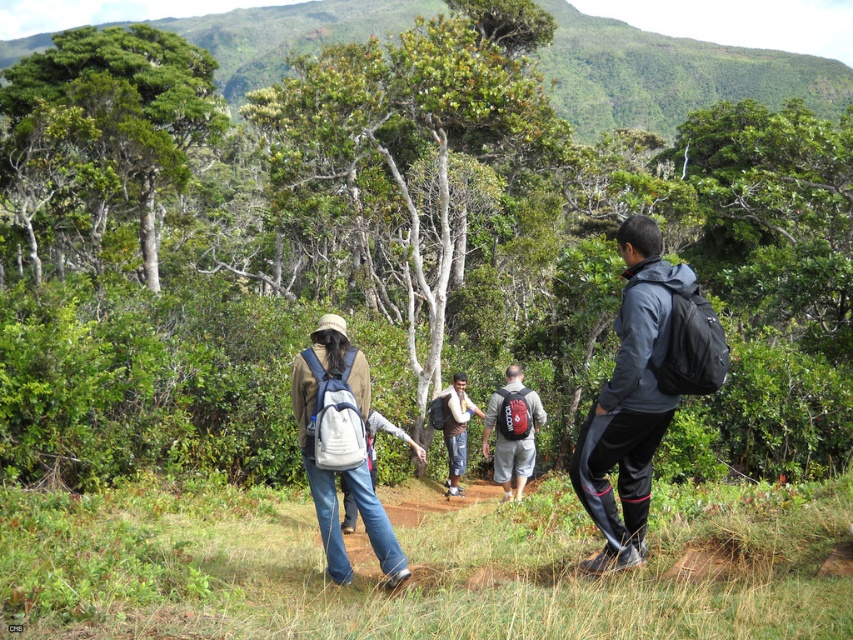
Can you confirm if matte white backpack at center-left is smaller than reddish-brown backpack at center?

Yes, matte white backpack at center-left is smaller than reddish-brown backpack at center.

At what (x,y) coordinates should I click in order to perform the action: click on matte white backpack at center-left. Please return your answer as a coordinate pair (x, y). Image resolution: width=853 pixels, height=640 pixels. Looking at the image, I should click on (318, 420).

Locate an element on the screen. This screenshot has width=853, height=640. matte white backpack at center-left is located at coordinates (318, 420).

Which is behind, point (434, 128) or point (466, 378)?

Positioned behind is point (434, 128).

Find the location of a particular element. The width and height of the screenshot is (853, 640). green leafy tree at center is located at coordinates (407, 157).

Is green matte tree at upper left behind matte gray jacket at center?

Yes.

Is green matte tree at upper left above matte gray jacket at center?

Yes.

Who is more forward, (129, 202) or (608, 568)?

Point (608, 568) is more forward.

Image resolution: width=853 pixels, height=640 pixels. In order to click on green matte tree at upper left in this screenshot , I will do `click(102, 140)`.